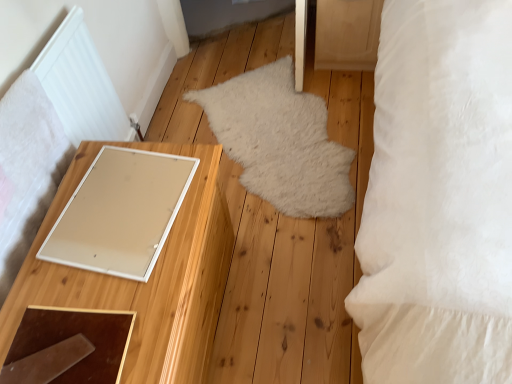
You are a GUI agent. You are given a task and a screenshot of the screen. Output one action in this format:
    pyautogui.click(x=<x>, y=<y>)
    Task: Click on the vacant area on top of white fluffy rug at center (from a real-world perspective)
    
    Given the screenshot: What is the action you would take?
    pyautogui.click(x=258, y=137)